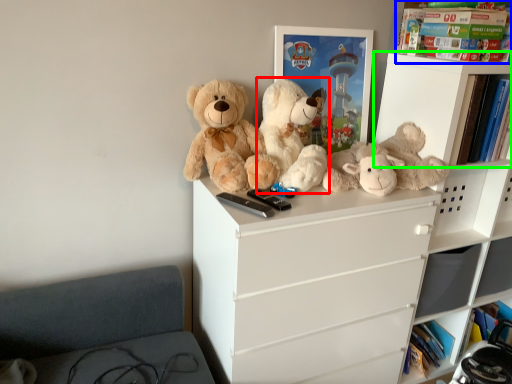
Question: Considering the real-world distances, which object is closest to teddy bear (highlighted by a red box)? book (highlighted by a blue box) or shelf (highlighted by a green box).

Choices:
 (A) book
 (B) shelf

Answer: (B)